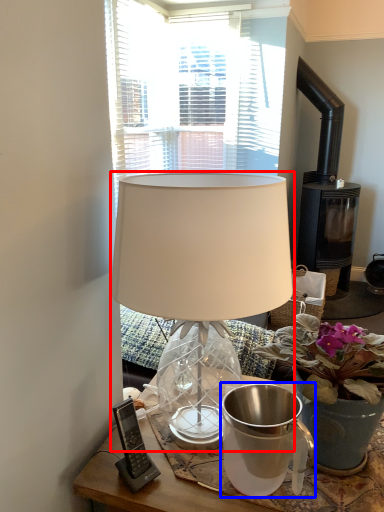
Question: Which of the following is the closest to the observer, lamp (highlighted by a red box) or jug (highlighted by a blue box)?

Choices:
 (A) lamp
 (B) jug

Answer: (A)